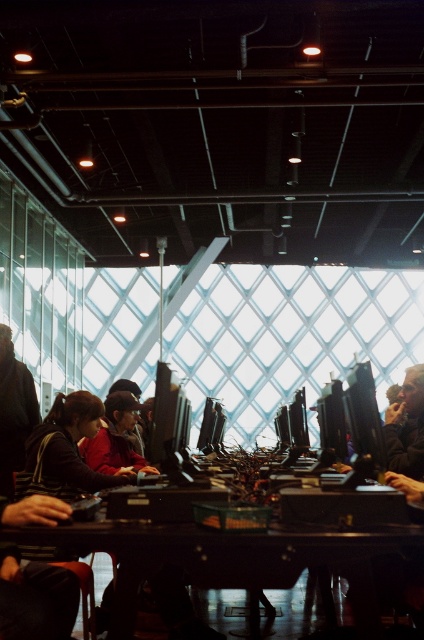
Question: Which object is the closest to the dark brown leather jacket at left?

Choices:
 (A) dark wood table at center
 (B) matte black jacket at center

Answer: (B)

Question: Which point is closer to the camera taking this photo?

Choices:
 (A) (100, 488)
 (B) (100, 440)

Answer: (A)

Question: Which point is farther to the camera?

Choices:
 (A) dark brown leather jacket at center
 (B) matte black jacket at center
 (C) red fabric jacket at center

Answer: (C)

Question: Can you confirm if dark brown leather jacket at left is positioned above dark brown leather jacket at center?

Choices:
 (A) no
 (B) yes

Answer: (A)

Question: Is dark brown leather jacket at left thinner than red fabric jacket at center?

Choices:
 (A) yes
 (B) no

Answer: (A)

Question: Does dark wood table at center have a larger size compared to matte black jacket at center?

Choices:
 (A) no
 (B) yes

Answer: (A)